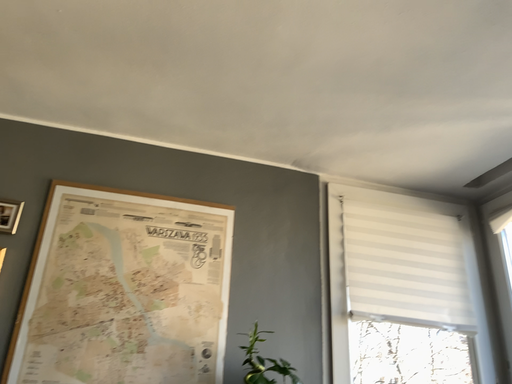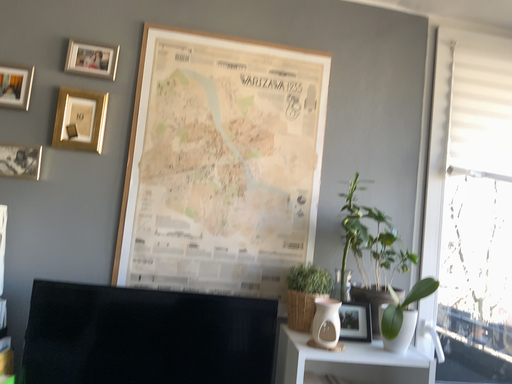
Question: Which way did the camera rotate in the video?

Choices:
 (A) rotated downward
 (B) rotated upward

Answer: (A)